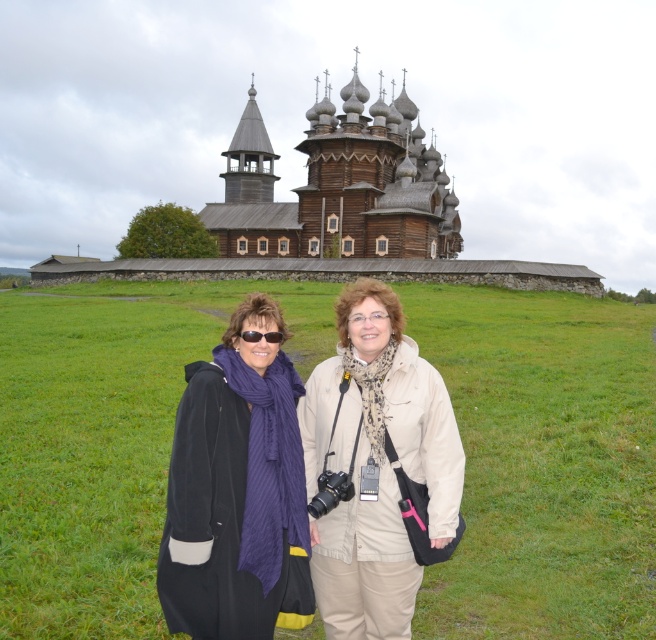
You are planning to take a photo of the green grass at center and the black fabric coat at center. Which object should you focus on if you want to capture the larger subject in your shot?

The green grass at center is larger in size than the black fabric coat at center, so you should focus on the green grass at center to capture the larger subject in your photo.

You are a photographer taking a picture of the green grass at center and the purple wool scarf at left. Which object will appear closer to the camera in the photo?

The green grass at center will appear closer to the camera because the purple wool scarf at left is behind it.

You are standing at the point marked by the coordinates point [586,602] and want to walk towards the church. Is the church in front of you or behind you?

The church is in front of you because you are 139.20 feet away from the point [586,602], indicating that the church is ahead in the direction you are facing.